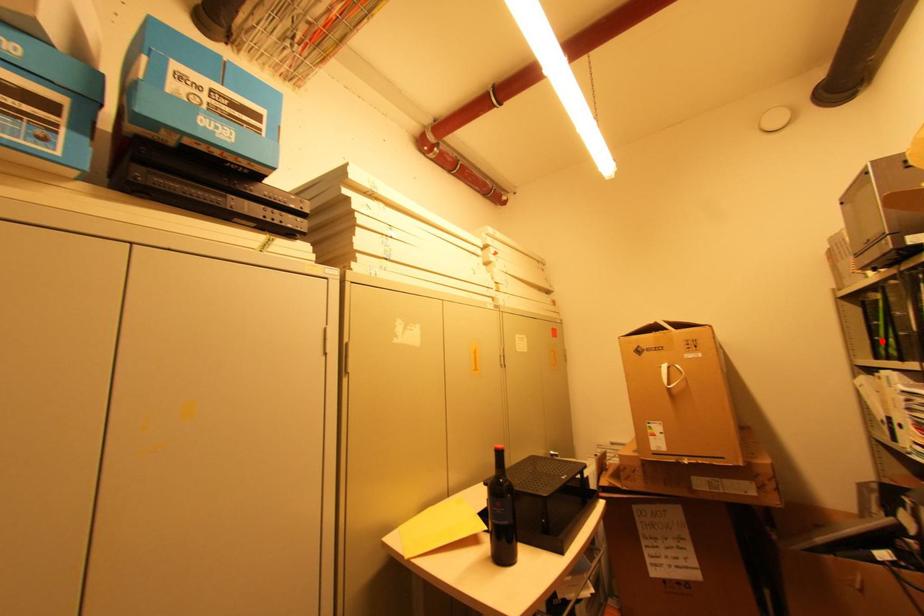
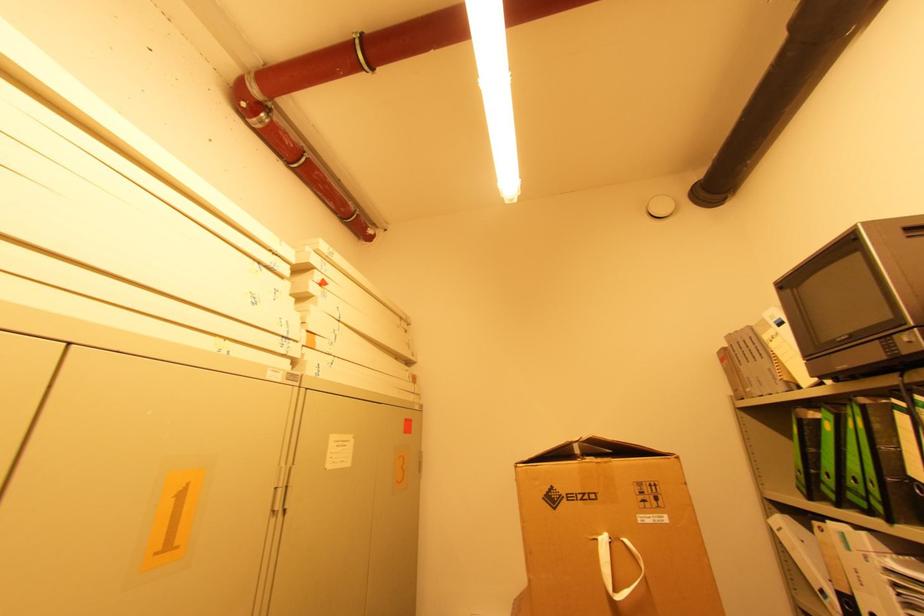
The point at the highlighted location is marked in the first image. Where is the corresponding point in the second image?

(822, 476)